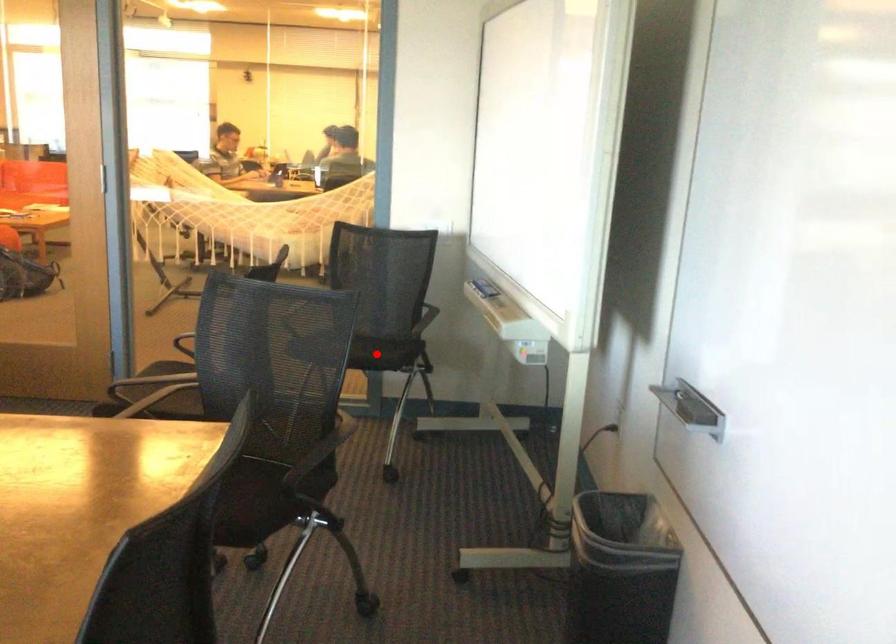
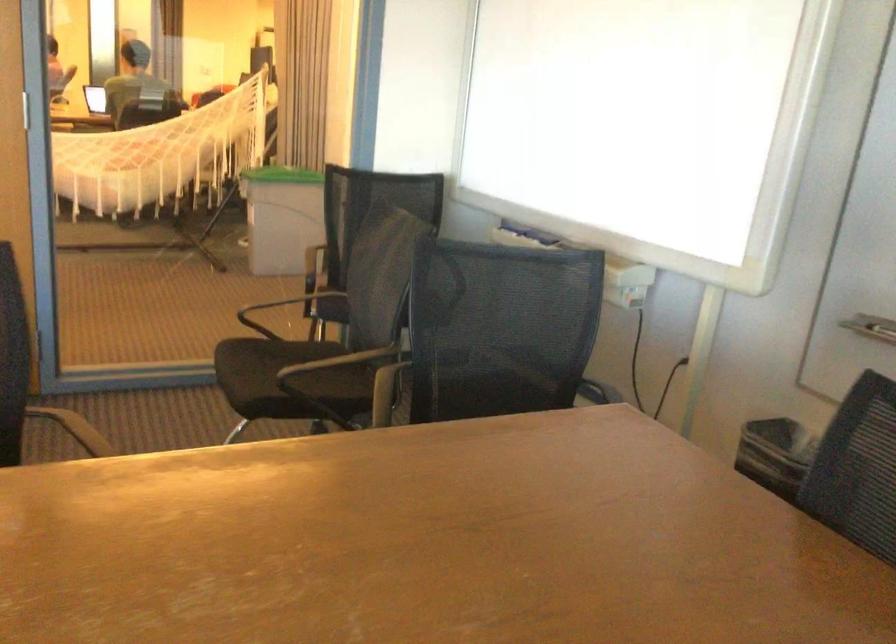
Question: I am providing you with two images of the same scene from different viewpoints. A red point is marked on the first image. At the location where the point appears in image 1, is it still visible in image 2?

Choices:
 (A) Yes
 (B) No

Answer: (B)